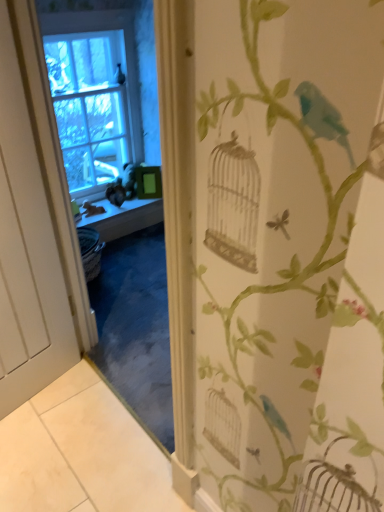
Where is `empty space that is ontop of clear glass window at upper left (from a real-world perspective)`? Image resolution: width=384 pixels, height=512 pixels. empty space that is ontop of clear glass window at upper left (from a real-world perspective) is located at coordinates [87, 20].